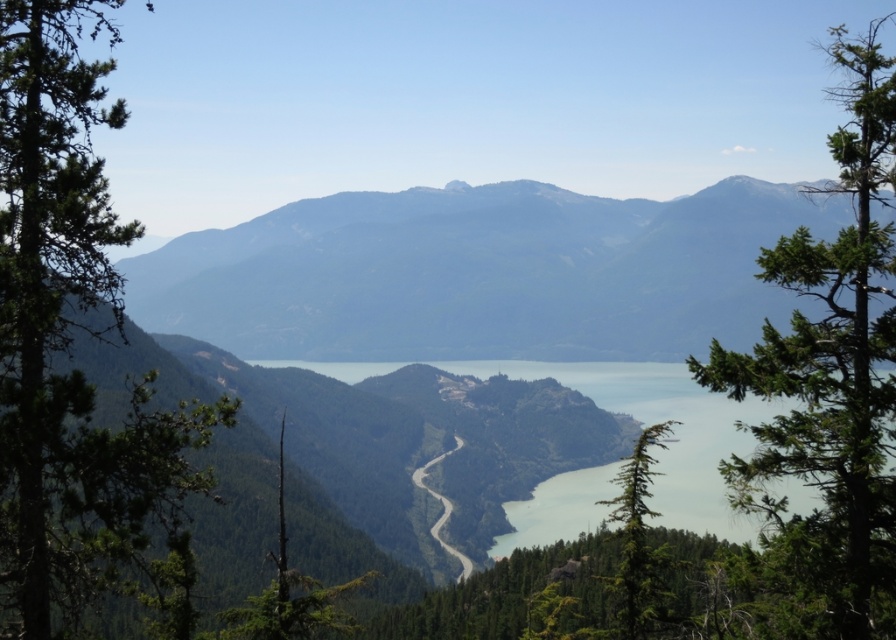
Identify the location of green textured tree at left. Image resolution: width=896 pixels, height=640 pixels. (69, 336).

Between green textured tree at left and green leafy tree at right, which one appears on the left side from the viewer's perspective?

green textured tree at left

Who is more distant from viewer, (x=93, y=556) or (x=767, y=541)?

The point (x=93, y=556) is behind.

Identify the location of green textured tree at left. (69, 336).

Can you confirm if gray rocky mountain at center is positioned above green textured tree at left?

No, gray rocky mountain at center is not above green textured tree at left.

Where is `gray rocky mountain at center`? The height and width of the screenshot is (640, 896). gray rocky mountain at center is located at coordinates (481, 273).

Does gray rocky mountain at center appear on the left side of green leafy tree at right?

Correct, you'll find gray rocky mountain at center to the left of green leafy tree at right.

Locate an element on the screen. The image size is (896, 640). gray rocky mountain at center is located at coordinates (481, 273).

Who is more forward, (737,198) or (854,348)?

Point (854,348)

This screenshot has height=640, width=896. What are the coordinates of `gray rocky mountain at center` in the screenshot? It's located at (481, 273).